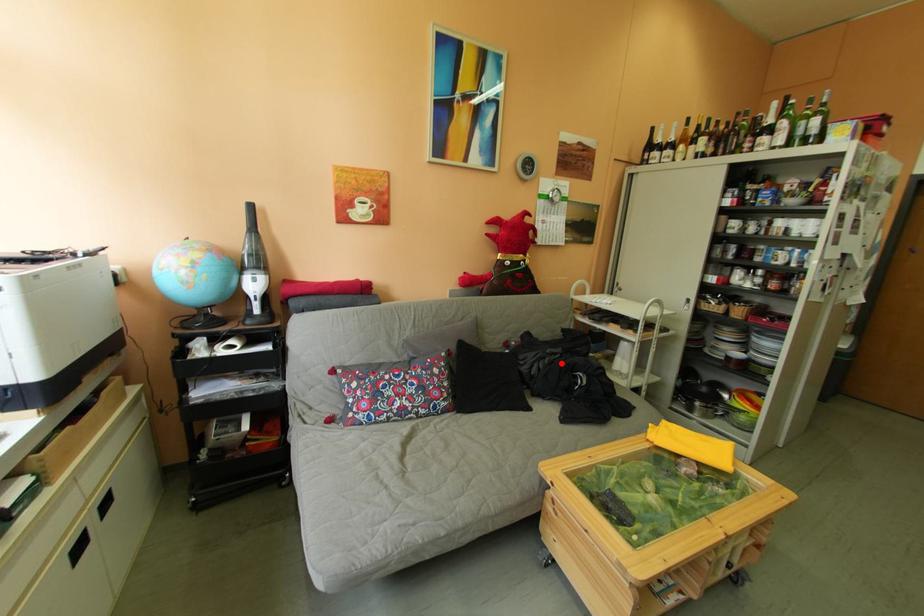
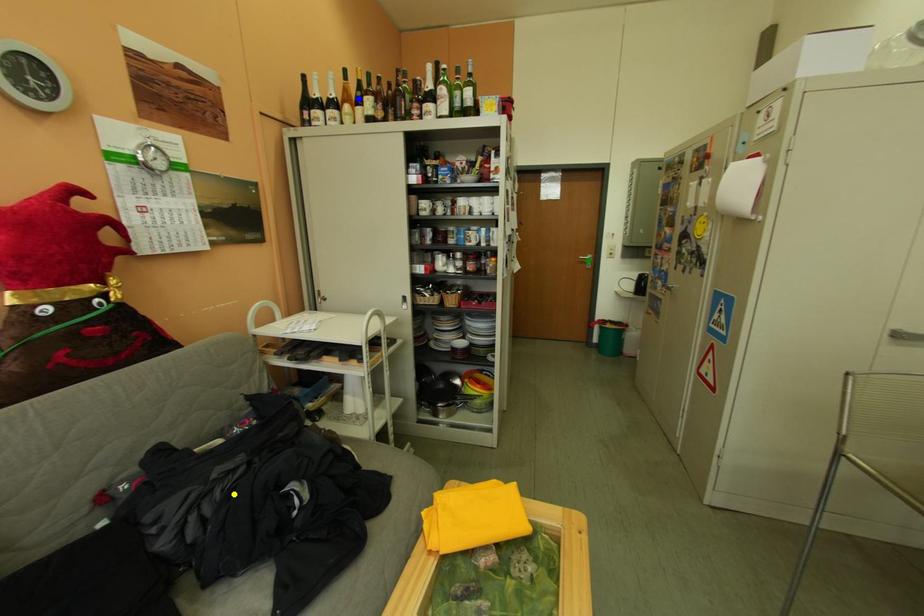
Question: I am providing you with two images of the same scene from different viewpoints. A red point is marked on the first image. You are given multiple points on the second image. Can you choose the point in image 2 that corresponds to the point in image 1?

Choices:
 (A) blue point
 (B) green point
 (C) yellow point

Answer: (C)